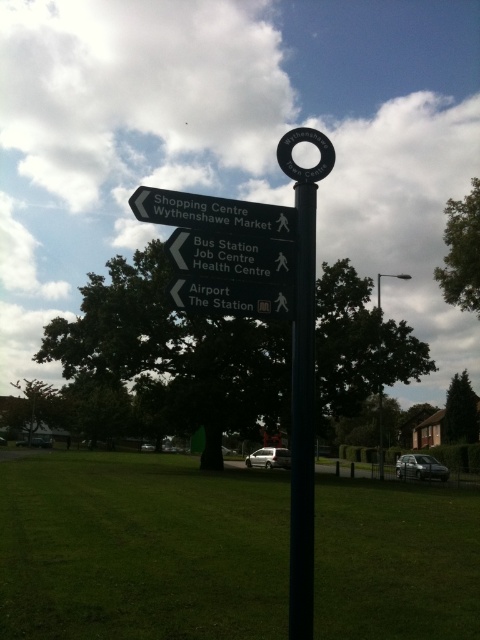
You are standing in a park and see the green grass at center and the white plastic sign at center. Which object is taller?

The green grass at center is much taller than the white plastic sign at center.

You are standing in front of a signpost and want to go to the Airport. According to the signpost, which direction should you turn to follow the arrow pointing towards the Airport? The signpost has a black plastic sign at upper left located at point (213,212) and other signs. Please answer based on the signpost layout.

The black plastic sign at upper left located at point (213,212) points left, so you should turn left to go to the Airport.

You are standing at the coordinates point (231, 256). What object are you standing on?

You are standing on the black plastic signpost at center.